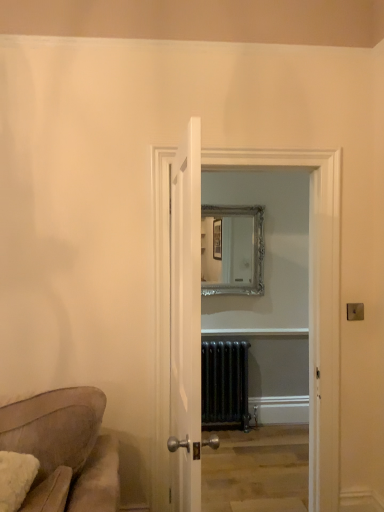
What do you see at coordinates (227, 250) in the screenshot?
I see `silver/gilded mirror at center` at bounding box center [227, 250].

Based on the photo, in order to face silver/gilded mirror at center, should I rotate leftwards or rightwards?

Rotate right and turn 5.076 degrees.

You are a GUI agent. You are given a task and a screenshot of the screen. Output one action in this format:
    pyautogui.click(x=<x>, y=<y>)
    Task: Click on the white wooden door at center
    
    Given the screenshot: What is the action you would take?
    (x=186, y=324)

In order to face metallic gold light switch at upper right, should I rotate leftwards or rightwards?

To face it directly, rotate right by 21.043 degrees.

In order to click on silver/gilded mirror at center in this screenshot , I will do (227, 250).

Is metallic gold light switch at upper right thinner than clear glass door at center?

Correct, the width of metallic gold light switch at upper right is less than that of clear glass door at center.

Considering the relative sizes of metallic gold light switch at upper right and clear glass door at center in the image provided, is metallic gold light switch at upper right shorter than clear glass door at center?

Yes, metallic gold light switch at upper right is shorter than clear glass door at center.

Image resolution: width=384 pixels, height=512 pixels. Identify the location of glass door in front of the metallic gold light switch at upper right. (313, 302).

Is metallic gold light switch at upper right beside clear glass door at center?

No.

Is point (338, 400) in front of point (174, 205)?

That is False.

Find the location of a particular element. The image size is (384, 512). door lying above the clear glass door at center (from the image's perspective) is located at coordinates coord(186,324).

From the image's perspective, does clear glass door at center appear higher than white wooden door at center?

No, from the image's perspective, clear glass door at center is not above white wooden door at center.

Which of these two, clear glass door at center or white wooden door at center, stands shorter?

white wooden door at center.

You are a GUI agent. You are given a task and a screenshot of the screen. Output one action in this format:
    pyautogui.click(x=<x>, y=<y>)
    Task: Click on the door on the left of black metal radiator at center
    
    Given the screenshot: What is the action you would take?
    pyautogui.click(x=186, y=324)

Based on the photo, is black metal radiator at center facing towards white wooden door at center?

Yes.

Is black metal radiator at center in front of or behind white wooden door at center in the image?

black metal radiator at center is positioned farther from the viewer than white wooden door at center.

Which is in front, point (226, 351) or point (171, 179)?

The point (171, 179) is closer to the camera.

Could you tell me if metallic gold light switch at upper right is turned towards black metal radiator at center?

No, metallic gold light switch at upper right is not oriented towards black metal radiator at center.

Which is behind, point (351, 310) or point (205, 364)?

The point (205, 364) is behind.

The image size is (384, 512). I want to click on radiator behind the metallic gold light switch at upper right, so click(x=225, y=384).

From a real-world perspective, is metallic gold light switch at upper right on black metal radiator at center?

Yes, from a real-world perspective, metallic gold light switch at upper right is on top of black metal radiator at center.

Looking at their sizes, would you say clear glass door at center is wider or thinner than black metal radiator at center?

Considering their sizes, clear glass door at center looks broader than black metal radiator at center.

Which is nearer, (242, 160) or (222, 407)?

Point (242, 160).

Consider the image. From a real-world perspective, is clear glass door at center above or below black metal radiator at center?

clear glass door at center is above black metal radiator at center.

Considering the relative positions of white wooden door at center and clear glass door at center in the image provided, is white wooden door at center to the left or to the right of clear glass door at center?

Based on their positions, white wooden door at center is located to the left of clear glass door at center.

Which is behind, white wooden door at center or clear glass door at center?

Positioned behind is clear glass door at center.

Is white wooden door at center beside clear glass door at center?

No, white wooden door at center is not making contact with clear glass door at center.

The width and height of the screenshot is (384, 512). Find the location of `radiator located below the silver/gilded mirror at center (from the image's perspective)`. radiator located below the silver/gilded mirror at center (from the image's perspective) is located at coordinates (225, 384).

From a real-world perspective, is silver/gilded mirror at center positioned above or below black metal radiator at center?

silver/gilded mirror at center is situated higher than black metal radiator at center in the real world.

Is silver/gilded mirror at center not within black metal radiator at center?

Indeed, silver/gilded mirror at center is completely outside black metal radiator at center.

Considering their positions, is silver/gilded mirror at center located in front of or behind black metal radiator at center?

silver/gilded mirror at center is behind black metal radiator at center.

Find the location of a particular element. This screenshot has width=384, height=512. light switch behind the clear glass door at center is located at coordinates (355, 311).

Locate an element on the screen. Image resolution: width=384 pixels, height=512 pixels. glass door below the white wooden door at center (from a real-world perspective) is located at coordinates [x=313, y=302].

Considering their positions, is silver/gilded mirror at center positioned closer to black metal radiator at center than clear glass door at center?

The object closer to black metal radiator at center is silver/gilded mirror at center.

When comparing their distances from clear glass door at center, does black metal radiator at center or metallic gold light switch at upper right seem closer?

Based on the image, metallic gold light switch at upper right appears to be nearer to clear glass door at center.

Consider the image. Looking at the image, which one is located further to clear glass door at center, white wooden door at center or silver/gilded mirror at center?

The object further to clear glass door at center is silver/gilded mirror at center.

When comparing their distances from black metal radiator at center, does metallic gold light switch at upper right or white wooden door at center seem closer?

white wooden door at center lies closer to black metal radiator at center than the other object.

When comparing their distances from clear glass door at center, does black metal radiator at center or silver/gilded mirror at center seem closer?

black metal radiator at center is closer to clear glass door at center.

Considering their positions, is metallic gold light switch at upper right positioned further to white wooden door at center than clear glass door at center?

metallic gold light switch at upper right is further to white wooden door at center.

From the image, which object appears to be farther from metallic gold light switch at upper right, black metal radiator at center or white wooden door at center?

black metal radiator at center is further to metallic gold light switch at upper right.

Looking at this image, looking at the image, which one is located further to white wooden door at center, metallic gold light switch at upper right or silver/gilded mirror at center?

silver/gilded mirror at center lies further to white wooden door at center than the other object.

The image size is (384, 512). I want to click on light switch between clear glass door at center and silver/gilded mirror at center from front to back, so click(x=355, y=311).

The image size is (384, 512). What are the coordinates of `glass door between white wooden door at center and silver/gilded mirror at center along the z-axis` in the screenshot? It's located at (313, 302).

Where is `light switch located between clear glass door at center and black metal radiator at center in the depth direction`? light switch located between clear glass door at center and black metal radiator at center in the depth direction is located at coordinates (355, 311).

At what (x,y) coordinates should I click in order to perform the action: click on glass door positioned between white wooden door at center and metallic gold light switch at upper right from near to far. Please return your answer as a coordinate pair (x, y). This screenshot has width=384, height=512. Looking at the image, I should click on (313, 302).